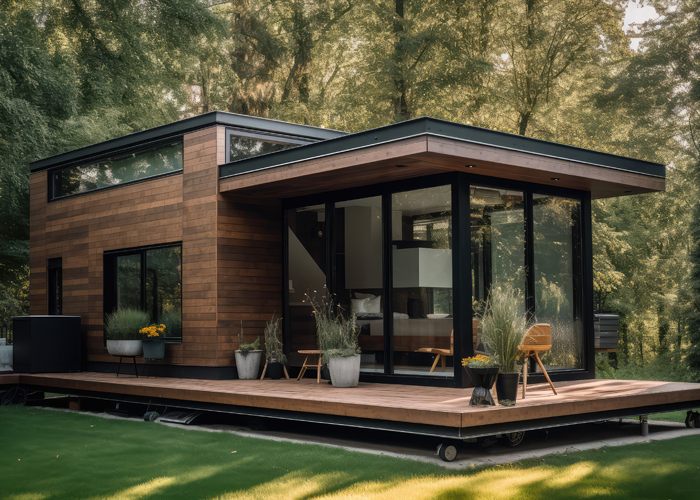
At what (x,y) coordinates should I click in order to perform the action: click on pots. Please return your answer as a coordinate pair (x, y). This screenshot has width=700, height=500. Looking at the image, I should click on (122, 340), (145, 347), (248, 362), (270, 366), (346, 368), (482, 377), (508, 385).